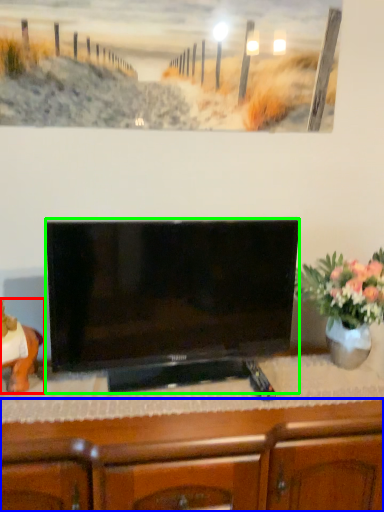
Question: Which object is the closest to the animal (highlighted by a red box)? Choose among these: cabinetry (highlighted by a blue box) or television (highlighted by a green box).

Choices:
 (A) cabinetry
 (B) television

Answer: (B)